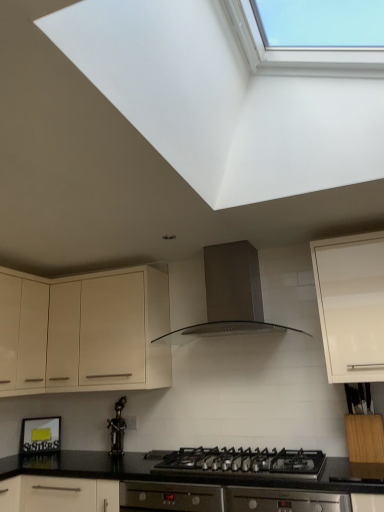
Question: Is white glossy cabinet at upper right, which ranks as the 2th cabinetry in back-to-front order, behind satin silver range hood at center?

Choices:
 (A) yes
 (B) no

Answer: (B)

Question: Is white glossy cabinet at upper right, which appears as the 1th cabinetry when viewed from the front, bigger than satin silver range hood at center?

Choices:
 (A) no
 (B) yes

Answer: (A)

Question: Can you confirm if white glossy cabinet at upper right, which appears as the 1th cabinetry when viewed from the front, is smaller than satin silver range hood at center?

Choices:
 (A) no
 (B) yes

Answer: (B)

Question: Is white glossy cabinet at upper right, which appears as the second cabinetry when viewed from the left, closer to camera compared to satin silver range hood at center?

Choices:
 (A) yes
 (B) no

Answer: (A)

Question: Would you consider white glossy cabinet at upper right, which is counted as the 1th cabinetry, starting from the right, to be distant from satin silver range hood at center?

Choices:
 (A) no
 (B) yes

Answer: (A)

Question: Is white glossy cabinet at upper right, which appears as the 1th cabinetry when viewed from the front, facing towards satin silver range hood at center?

Choices:
 (A) yes
 (B) no

Answer: (B)

Question: Is bronze statue at center not inside white glossy cabinet at upper right, which ranks as the 2th cabinetry in back-to-front order?

Choices:
 (A) yes
 (B) no

Answer: (A)

Question: Is bronze statue at center shorter than white glossy cabinet at upper right, which is counted as the 1th cabinetry, starting from the right?

Choices:
 (A) no
 (B) yes

Answer: (B)

Question: Is bronze statue at center turned away from white glossy cabinet at upper right, which appears as the second cabinetry when viewed from the left?

Choices:
 (A) yes
 (B) no

Answer: (B)

Question: From a real-world perspective, is bronze statue at center over white glossy cabinet at upper right, which appears as the 1th cabinetry when viewed from the front?

Choices:
 (A) yes
 (B) no

Answer: (B)

Question: Would you consider bronze statue at center to be distant from white glossy cabinet at upper right, which appears as the 1th cabinetry when viewed from the front?

Choices:
 (A) yes
 (B) no

Answer: (A)

Question: Considering the relative sizes of bronze statue at center and white glossy cabinet at upper right, which is counted as the 1th cabinetry, starting from the right, in the image provided, is bronze statue at center bigger than white glossy cabinet at upper right, which is counted as the 1th cabinetry, starting from the right,?

Choices:
 (A) no
 (B) yes

Answer: (A)

Question: From a real-world perspective, does black matte gas stove at center sit lower than matte cream cabinet at upper left, the 2th cabinetry viewed from the front?

Choices:
 (A) yes
 (B) no

Answer: (A)